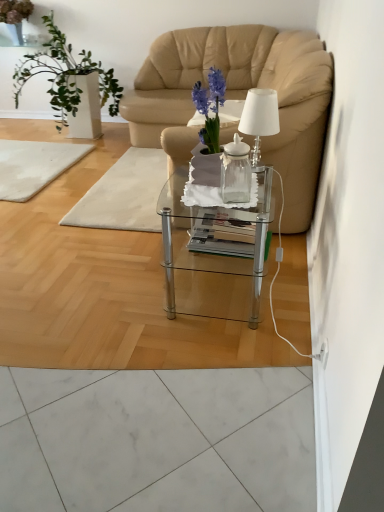
Locate an element on the screen. vacant area situated below clear glass coffee table at center (from a real-world perspective) is located at coordinates (226, 295).